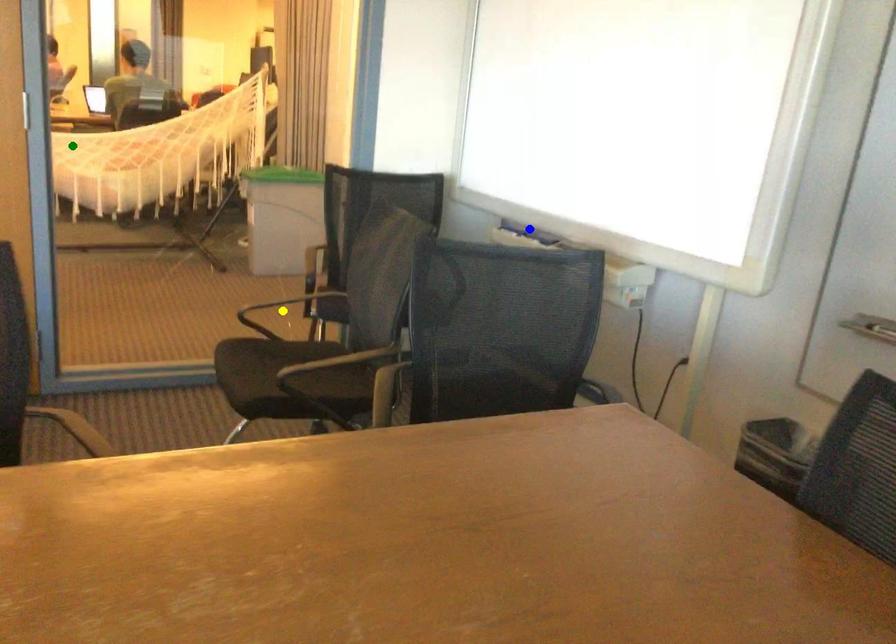
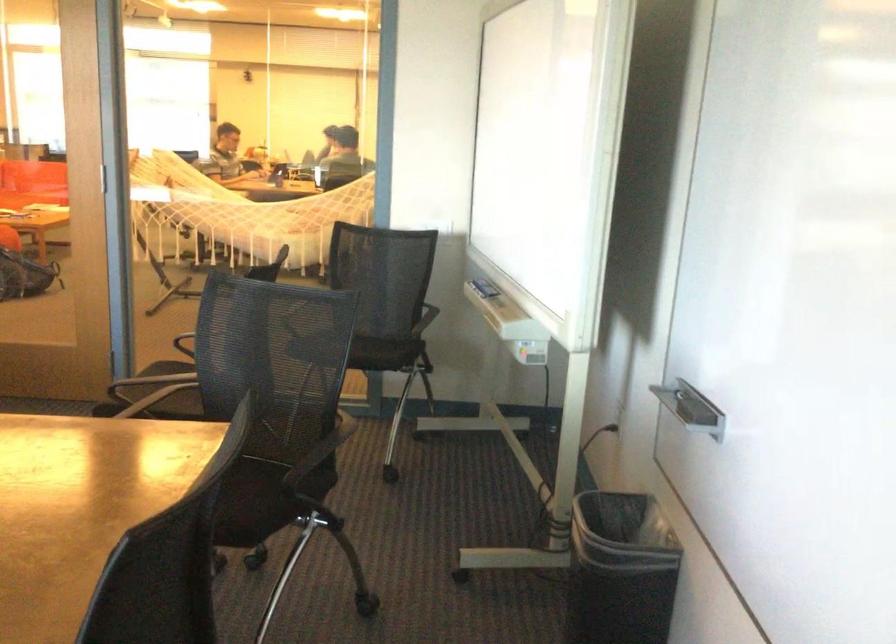
I am providing you with two images of the same scene from different viewpoints. Three points are marked in image1. Which point corresponds to a part or object that is occluded in image2?In image1, three points are marked. Which of them correspond to a part or object that is occluded in image2?Among the three points shown in image1, which one corresponds to a part or object that is no longer visible due to occlusion in image2?

Invisible in image2: yellow point.